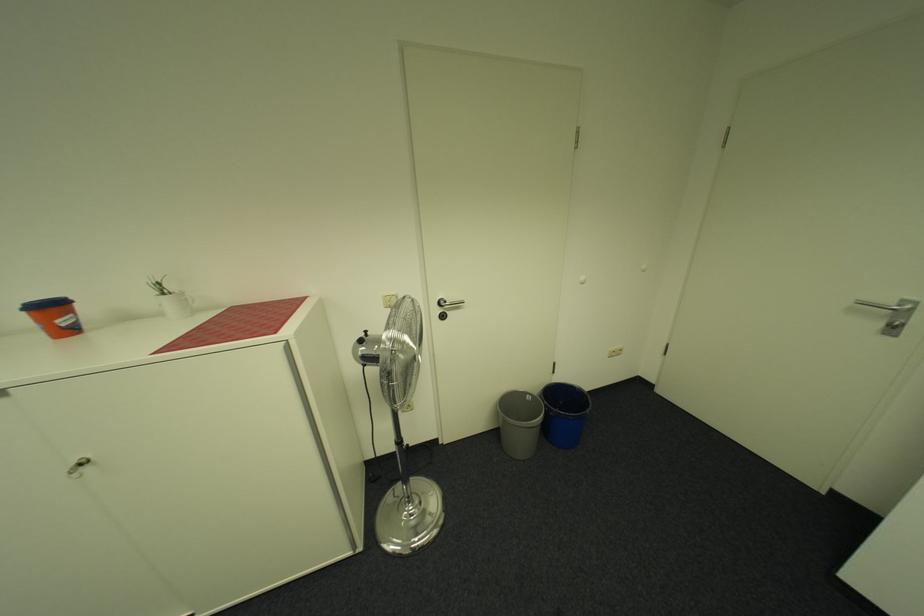
At what (x,y) coordinates should I click in order to perform the action: click on white mug. Please return your answer as a coordinate pair (x, y). The height and width of the screenshot is (616, 924). Looking at the image, I should click on (176, 305).